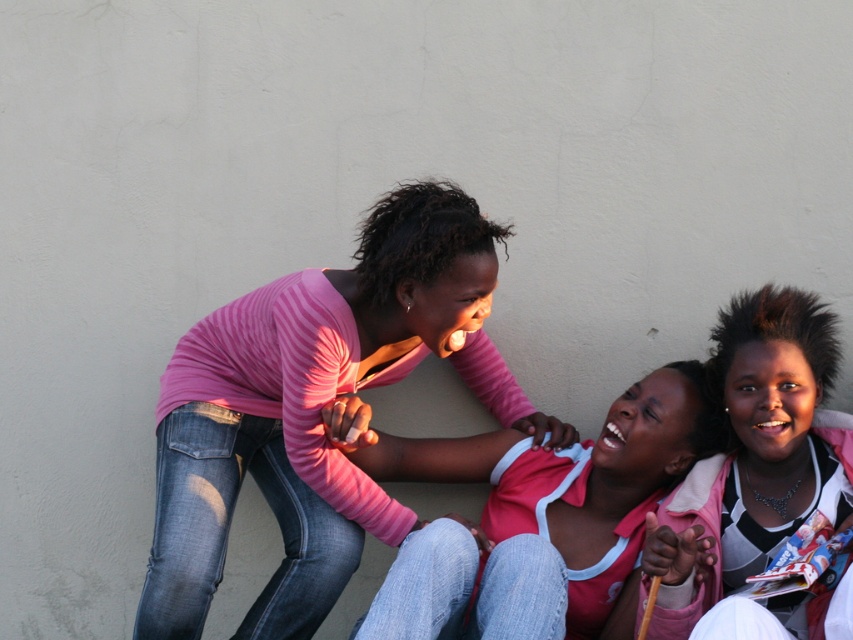
Question: Does pink matte shirt at center have a lesser width compared to pink fabric at center?

Choices:
 (A) no
 (B) yes

Answer: (A)

Question: Which of these objects is positioned farthest from the pink matte shirt at center?

Choices:
 (A) pink striped shirt at center
 (B) pink fabric at center

Answer: (A)

Question: Is pink striped shirt at center positioned behind pink matte shirt at center?

Choices:
 (A) no
 (B) yes

Answer: (B)

Question: Among these points, which one is nearest to the camera?

Choices:
 (A) (294, 628)
 (B) (566, 458)
 (C) (651, 561)

Answer: (C)

Question: Which object is the farthest from the pink fabric at center?

Choices:
 (A) pink matte shirt at center
 (B) pink striped shirt at center

Answer: (B)

Question: Is pink striped shirt at center smaller than pink matte shirt at center?

Choices:
 (A) no
 (B) yes

Answer: (A)